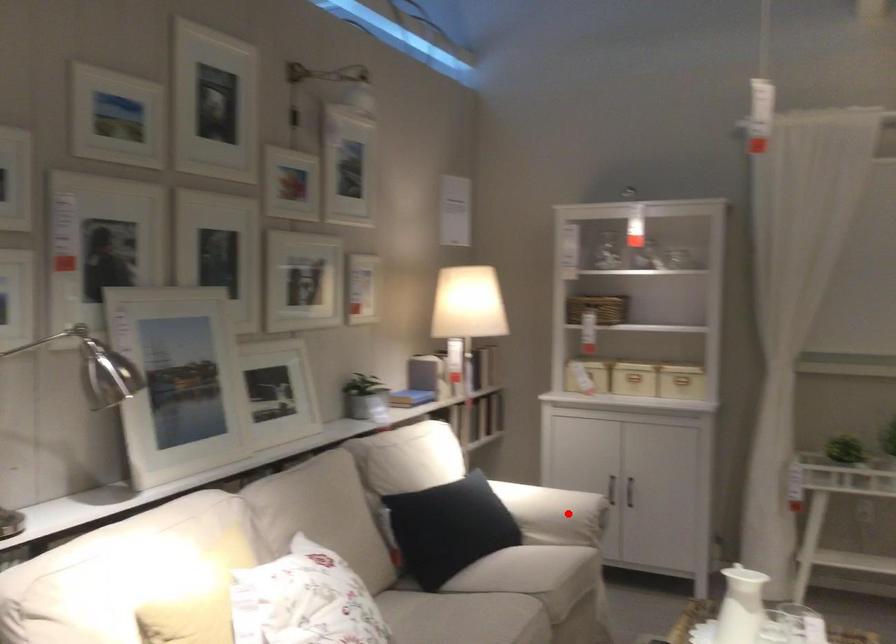
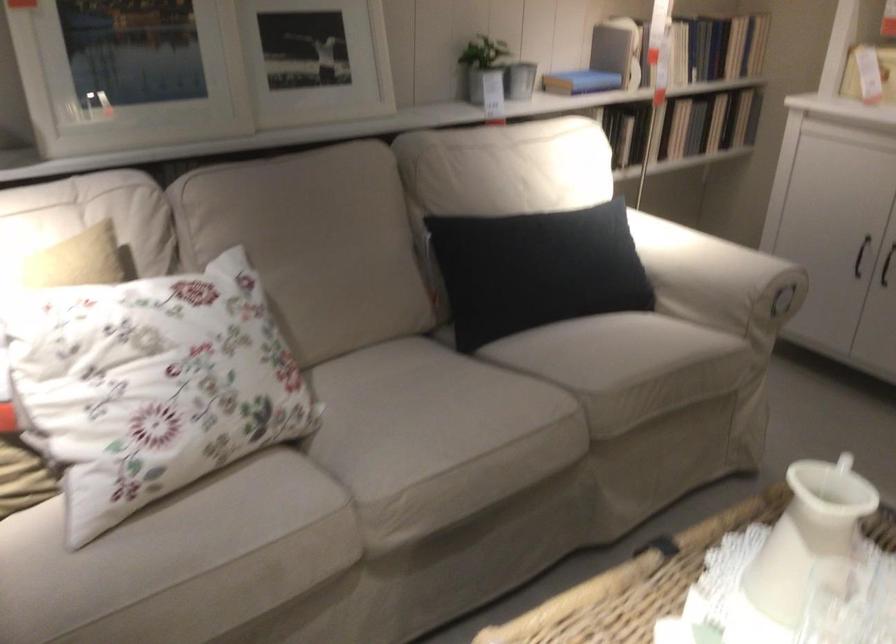
In the second image, find the point that corresponds to the highlighted location in the first image.

(717, 279)